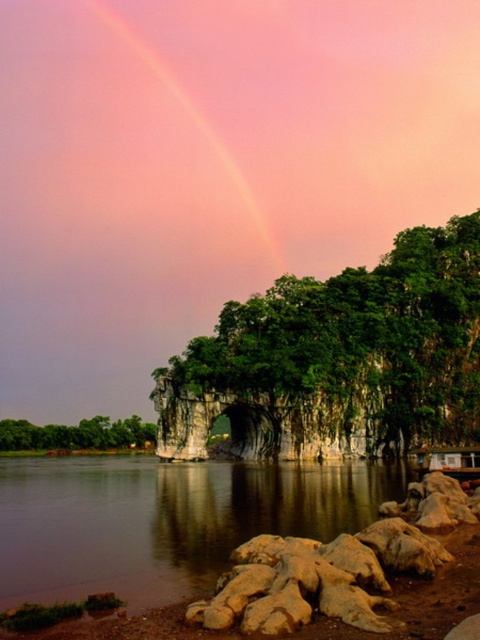
Is the position of smooth brown water at lower center less distant than that of rustic stone boulder at lower right?

That is False.

Which is in front, point (291, 525) or point (328, 580)?

Point (328, 580) is more forward.

Identify the location of smooth brown water at lower center. The image size is (480, 640). (165, 520).

Is rustic stone boulder at lower right bigger than pink translucent rainbow at upper center?

No.

Is rustic stone boulder at lower right smaller than pink translucent rainbow at upper center?

Indeed, rustic stone boulder at lower right has a smaller size compared to pink translucent rainbow at upper center.

You are a GUI agent. You are given a task and a screenshot of the screen. Output one action in this format:
    pyautogui.click(x=<x>, y=<y>)
    Task: Click on the rustic stone boulder at lower right
    
    Given the screenshot: What is the action you would take?
    pyautogui.click(x=336, y=566)

Is smooth brown water at lower center wider than green leafy tree at lower left?

Indeed, smooth brown water at lower center has a greater width compared to green leafy tree at lower left.

Can you confirm if smooth brown water at lower center is positioned to the right of green leafy tree at lower left?

Correct, you'll find smooth brown water at lower center to the right of green leafy tree at lower left.

The image size is (480, 640). Find the location of `smooth brown water at lower center`. smooth brown water at lower center is located at coordinates (165, 520).

At what (x,y) coordinates should I click in order to perform the action: click on smooth brown water at lower center. Please return your answer as a coordinate pair (x, y). Image resolution: width=480 pixels, height=640 pixels. Looking at the image, I should click on (165, 520).